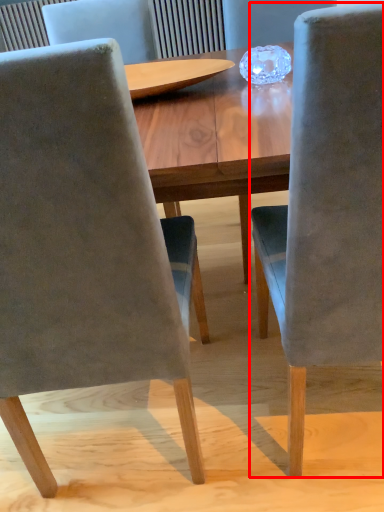
Question: Considering the relative positions of chair (annotated by the red box) and chair in the image provided, where is chair (annotated by the red box) located with respect to the staircase?

Choices:
 (A) left
 (B) right

Answer: (B)